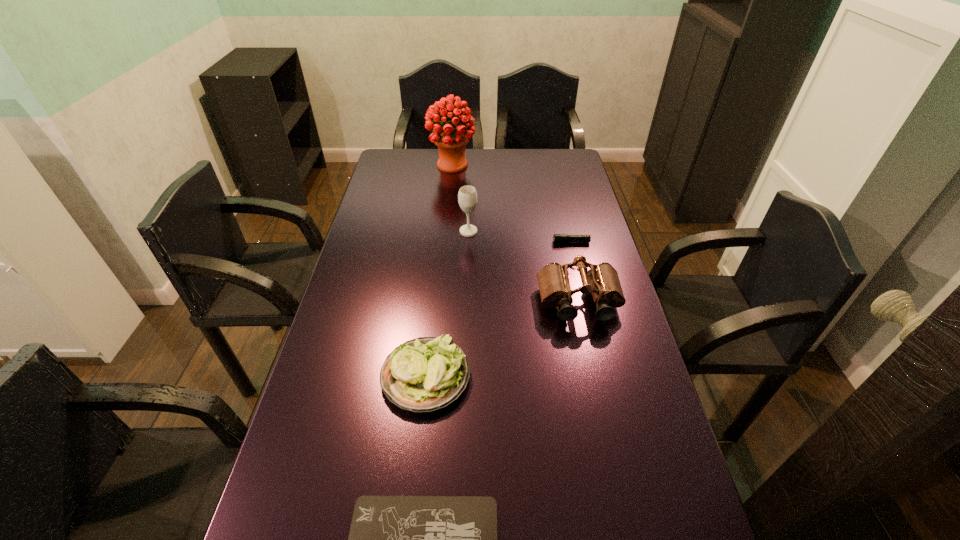
Where is `vacant region located on the left of the second farthest object`? The width and height of the screenshot is (960, 540). vacant region located on the left of the second farthest object is located at coordinates (370, 231).

At what (x,y) coordinates should I click in order to perform the action: click on free point located through the eyepieces of the binoculars. Please return your answer as a coordinate pair (x, y). This screenshot has width=960, height=540. Looking at the image, I should click on tap(589, 352).

You are a GUI agent. You are given a task and a screenshot of the screen. Output one action in this format:
    pyautogui.click(x=<x>, y=<y>)
    Task: Click on the vacant space situated on the front of the second nearest object
    This screenshot has height=540, width=960.
    Given the screenshot: What is the action you would take?
    pyautogui.click(x=409, y=532)

In order to click on vacant space located at the lens end of the flashlight in this screenshot , I will do `click(517, 242)`.

Where is `blank space located at the lens end of the flashlight`? The width and height of the screenshot is (960, 540). blank space located at the lens end of the flashlight is located at coordinates (465, 242).

Identify the location of vacant space situated at the lens end of the flashlight. The width and height of the screenshot is (960, 540). (485, 242).

I want to click on object located at the far edge, so click(451, 141).

This screenshot has height=540, width=960. Find the location of `binoculars at the right edge`. binoculars at the right edge is located at coordinates pos(602,280).

This screenshot has width=960, height=540. In order to click on flashlight present at the right edge in this screenshot , I will do `click(557, 238)`.

In the image, there is a desktop. At what (x,y) coordinates should I click in order to perform the action: click on blank space at the far edge. Please return your answer as a coordinate pair (x, y). Image resolution: width=960 pixels, height=540 pixels. Looking at the image, I should click on (532, 164).